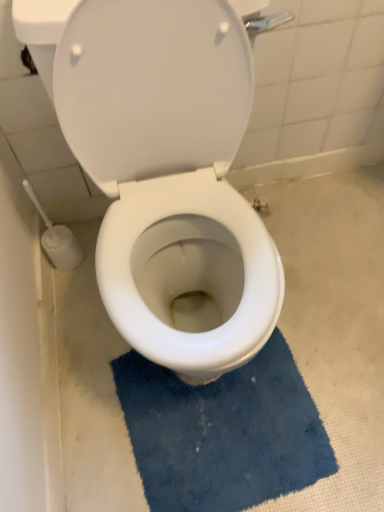
Question: In terms of size, does white glossy toilet at center appear bigger or smaller than white plastic toilet brush at lower left?

Choices:
 (A) big
 (B) small

Answer: (A)

Question: Relative to white plastic toilet brush at lower left, is white glossy toilet at center in front or behind?

Choices:
 (A) behind
 (B) front

Answer: (B)

Question: Which is farther from the white glossy toilet at center?

Choices:
 (A) white plastic toilet brush at lower left
 (B) blue textured bath mat at lower center

Answer: (A)

Question: Which of these objects is positioned closest to the blue textured bath mat at lower center?

Choices:
 (A) white glossy toilet at center
 (B) white plastic toilet brush at lower left

Answer: (A)